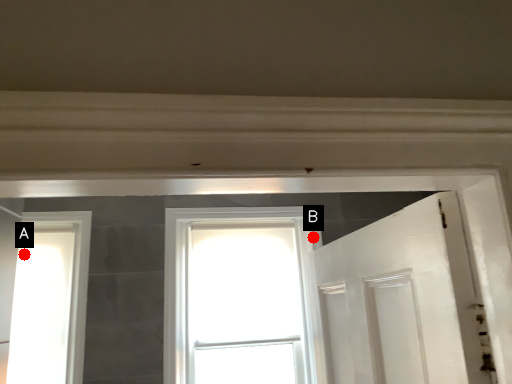
Question: Two points are circled on the image, labeled by A and B beside each circle. Which point is further to the camera?

Choices:
 (A) A is further
 (B) B is further

Answer: (B)